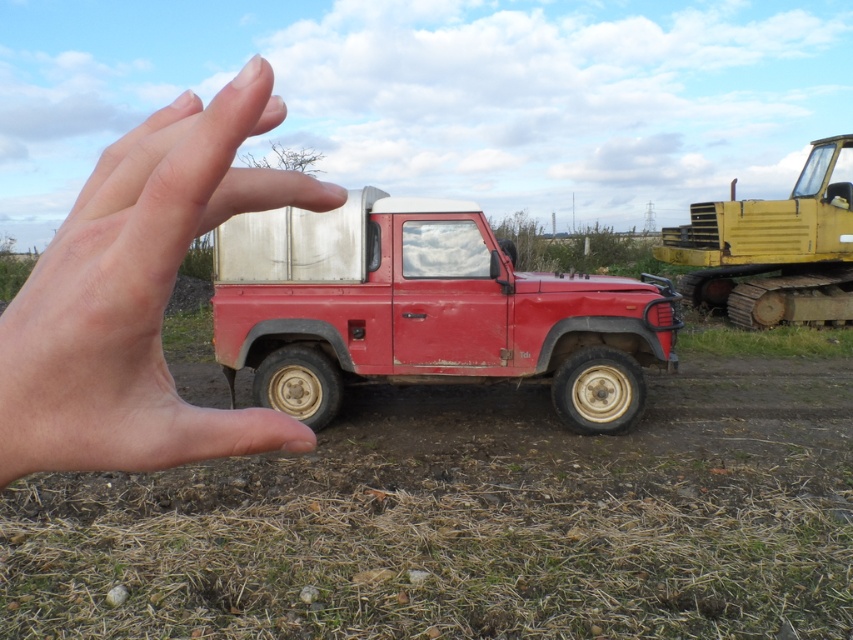
You are a photographer who wants to focus on the rusty metal truck at center. Since the skinny flesh at center is in the way, can you move the hand to the left to get a clear shot?

The skinny flesh at center is behind the rusty metal truck at center, so moving the hand to the left won not help because the hand is already behind the truck and not blocking the view.

You are a photographer who wants to capture the Land Rover Defender in the image. The photographer notices a point at coordinate (138, 296) which is part of the scene. What is the object located at that coordinate?

The point at coordinate (138, 296) indicates skinny flesh at center, which is part of the person whose hand is framing the scene in the foreground.

You are a photographer who wants to capture a closeup of the skinny flesh at center and the yellow rubber tracked vehicle at right in the background. Based on the scene description, can you confirm if the hand will appear larger in the photo than the tracked vehicle?

The skinny flesh at center has a smaller size compared to the yellow rubber tracked vehicle at right, so the hand will appear smaller in the photo than the tracked vehicle.